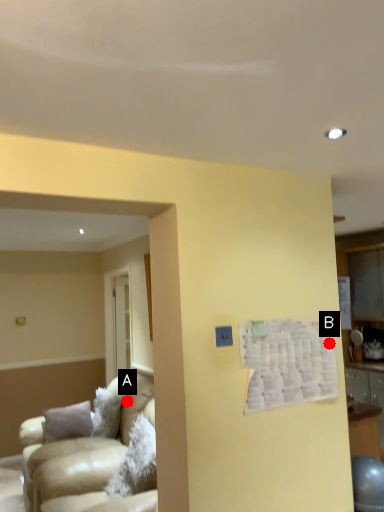
Question: Two points are circled on the image, labeled by A and B beside each circle. Which point is closer to the camera?

Choices:
 (A) A is closer
 (B) B is closer

Answer: (B)